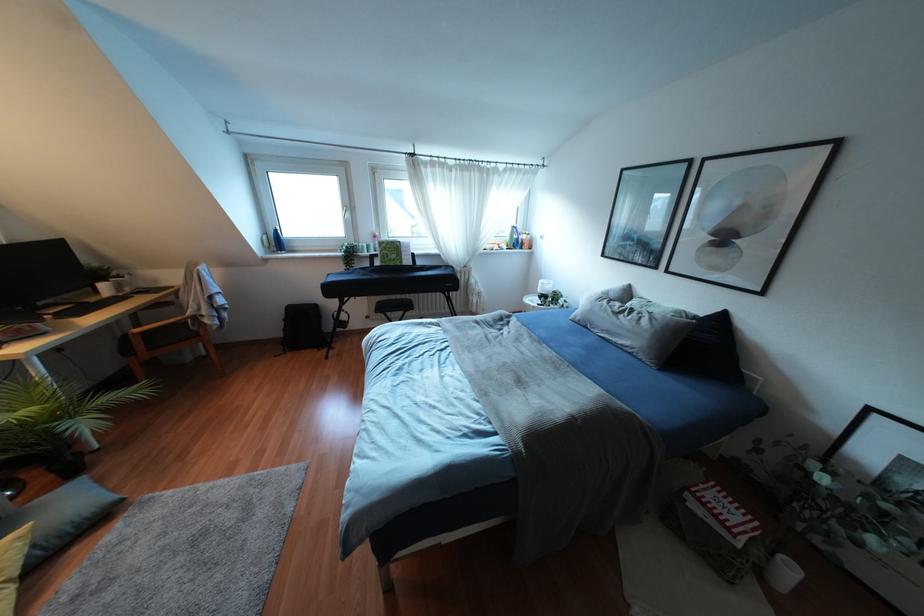
Find where to lift the white ceramic mug. Please return your answer as a coordinate pair (x, y).

(783, 573)